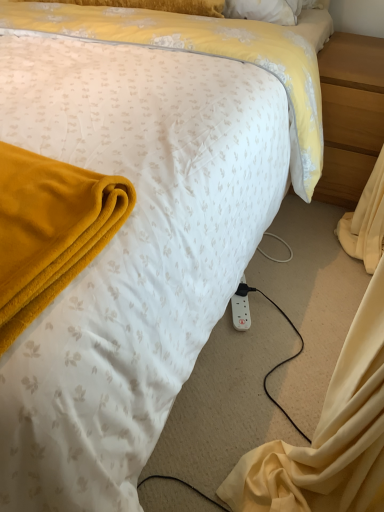
Identify the location of free space behind white plastic power outlet at lower right. (263, 265).